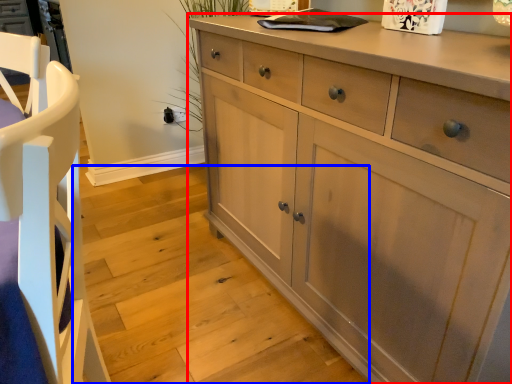
Question: Which object appears closest to the camera in this image, chest of drawers (highlighted by a red box) or stair (highlighted by a blue box)?

Choices:
 (A) chest of drawers
 (B) stair

Answer: (A)